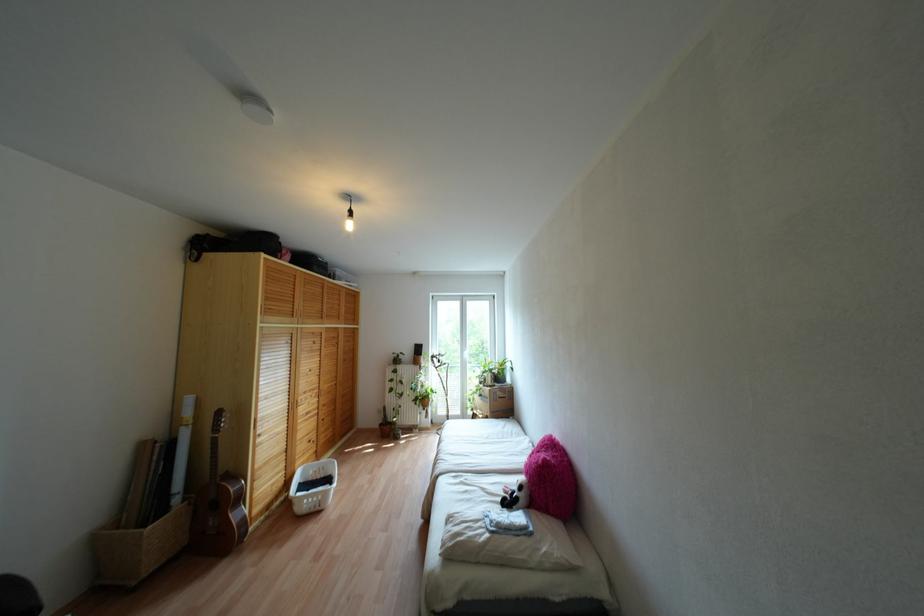
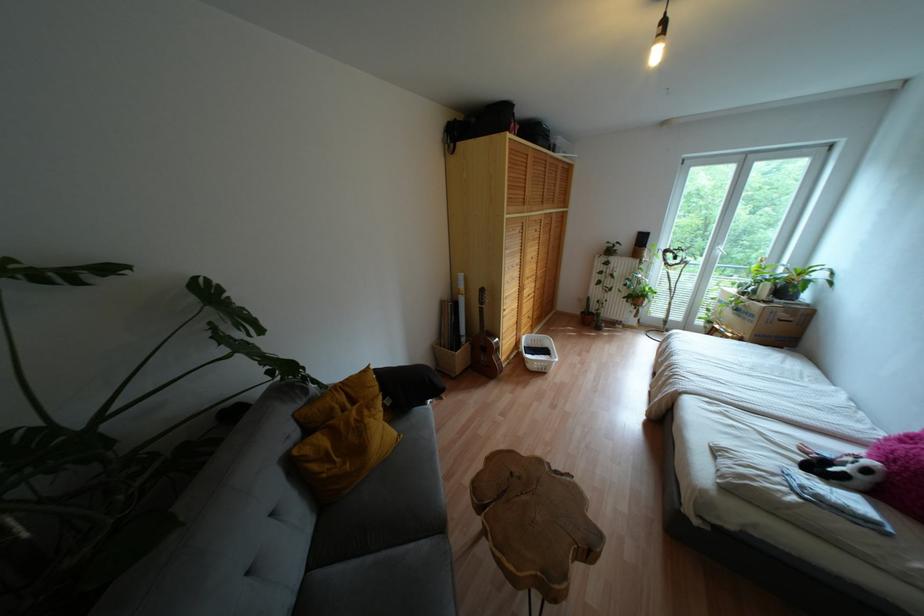
The point at (217, 411) is marked in the first image. Where is the corresponding point in the second image?

(481, 290)